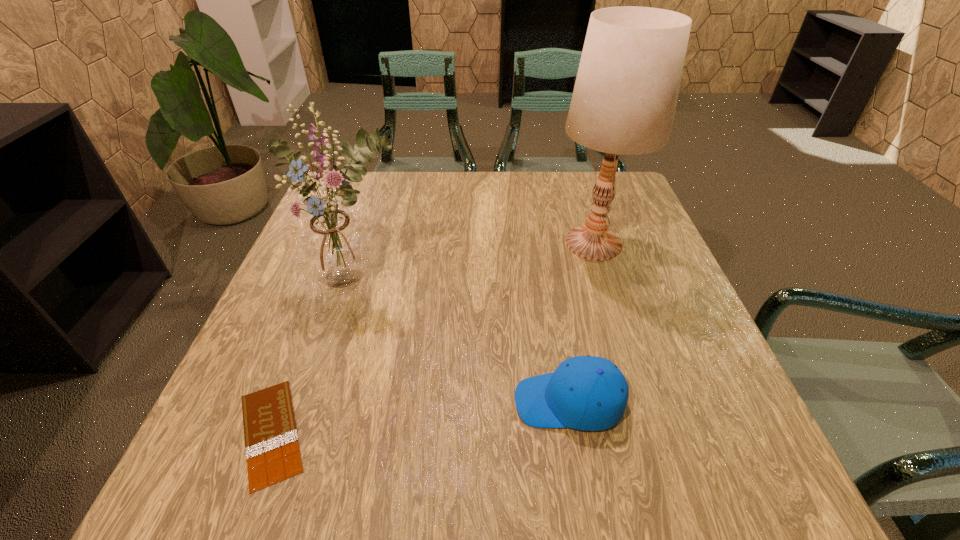
The image size is (960, 540). Find the location of `the tallest object`. the tallest object is located at coordinates (624, 100).

Image resolution: width=960 pixels, height=540 pixels. In order to click on bouquet in this screenshot , I will do `click(335, 247)`.

Find the location of a particular element. the second shortest object is located at coordinates (587, 393).

The width and height of the screenshot is (960, 540). Identify the location of the shortest object. (272, 449).

Locate an element on the screen. The image size is (960, 540). free location located on the front of the lamp is located at coordinates (639, 392).

I want to click on vacant space situated 0.120m on the front-facing side of the second tallest object, so click(x=334, y=354).

Identify the location of vacant region located on the front-facing side of the cap. (356, 402).

I want to click on vacant area located on the front-facing side of the cap, so click(362, 402).

The height and width of the screenshot is (540, 960). What are the coordinates of `free space located on the front-facing side of the cap` in the screenshot? It's located at (298, 402).

Find the location of a particular element. This screenshot has height=540, width=960. vacant space located 0.330m on the back of the chocolate bar is located at coordinates (335, 262).